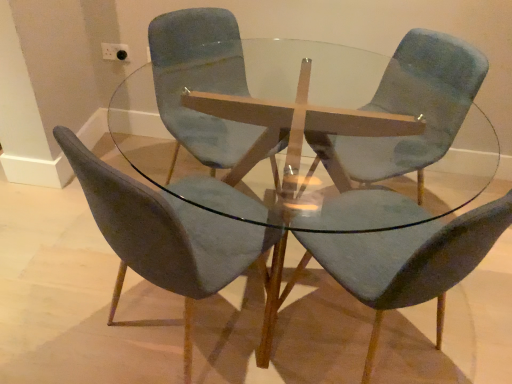
This screenshot has width=512, height=384. What do you see at coordinates (417, 105) in the screenshot?
I see `velvet blue chair at center, positioned as the first chair in right-to-left order` at bounding box center [417, 105].

Describe the element at coordinates (378, 137) in the screenshot. The height and width of the screenshot is (384, 512). I see `transparent glass table at center` at that location.

This screenshot has height=384, width=512. I want to click on velvet blue chair at center, which is the 2th chair in right-to-left order, so click(406, 262).

I want to click on velvet blue chair at center, which is the fourth chair in left-to-right order, so click(417, 105).

Do you think velvet blue chair at center, which is the fourth chair in left-to-right order, is within velvet blue chair at center, which is counted as the 4th chair, starting from the right, or outside of it?

velvet blue chair at center, which is the fourth chair in left-to-right order, lies outside velvet blue chair at center, which is counted as the 4th chair, starting from the right.

Is velvet blue chair at center, which is the fourth chair in left-to-right order, turned away from velvet blue chair at center, which is counted as the 4th chair, starting from the right?

velvet blue chair at center, which is the fourth chair in left-to-right order, is not turned away from velvet blue chair at center, which is counted as the 4th chair, starting from the right.

Is velvet blue chair at center, which is the fourth chair in left-to-right order, taller than velvet blue chair at center, which is counted as the 4th chair, starting from the right?

No.

Which is in front, point (413, 52) or point (111, 314)?

Point (111, 314)

In the scene shown: From their relative heights in the image, would you say velvet blue chair at center, which is the 2th chair in right-to-left order, is taller or shorter than velvet blue chair at center, which is the fourth chair in left-to-right order?

Clearly, velvet blue chair at center, which is the 2th chair in right-to-left order, is shorter compared to velvet blue chair at center, which is the fourth chair in left-to-right order.

Is velvet blue chair at center, which is the 2th chair in right-to-left order, aimed at velvet blue chair at center, which is the fourth chair in left-to-right order?

No.

From a real-world perspective, which object stands above the other?

velvet blue chair at center, which is counted as the 3th chair, starting from the left, from a real-world perspective.

From the image's perspective, is velvet blue chair at center, which is counted as the 3th chair, starting from the left, positioned above or below velvet blue chair at center, which is the fourth chair in left-to-right order?

velvet blue chair at center, which is counted as the 3th chair, starting from the left, is situated lower than velvet blue chair at center, which is the fourth chair in left-to-right order, in the image.

Which of these two, transparent glass table at center or velvet blue chair at center, placed as the 2th chair when sorted from left to right, stands shorter?

With less height is transparent glass table at center.

Considering their positions, is transparent glass table at center located in front of or behind velvet blue chair at center, placed as the 2th chair when sorted from left to right?

transparent glass table at center is in front of velvet blue chair at center, placed as the 2th chair when sorted from left to right.

Which chair is the 1st one when counting from the back of the transparent glass table at center? Please provide its 2D coordinates.

[(200, 82)]

Does transparent glass table at center have a smaller size compared to velvet blue chair at center, placed as the 2th chair when sorted from left to right?

No.

From the picture: How different are the orientations of velvet blue chair at center, which is the 2th chair in right-to-left order, and velvet blue chair at center, which appears as the 3th chair when viewed from the right, in degrees?

The facing directions of velvet blue chair at center, which is the 2th chair in right-to-left order, and velvet blue chair at center, which appears as the 3th chair when viewed from the right, are 179 degrees apart.

From the image's perspective, would you say velvet blue chair at center, which is the 2th chair in right-to-left order, is shown under velvet blue chair at center, placed as the 2th chair when sorted from left to right?

Indeed, from the image's perspective, velvet blue chair at center, which is the 2th chair in right-to-left order, is shown beneath velvet blue chair at center, placed as the 2th chair when sorted from left to right.

Does velvet blue chair at center, which is the 2th chair in right-to-left order, have a lesser height compared to velvet blue chair at center, which appears as the 3th chair when viewed from the right?

Yes.

Consider the image. Would you say velvet blue chair at center, placed as the 2th chair when sorted from left to right, contains velvet blue chair at center, which is the fourth chair in left-to-right order?

No, velvet blue chair at center, which is the fourth chair in left-to-right order, is not surrounded by velvet blue chair at center, placed as the 2th chair when sorted from left to right.

Is velvet blue chair at center, which appears as the 3th chair when viewed from the right, smaller than velvet blue chair at center, positioned as the first chair in right-to-left order?

No.

Which is in front, point (199, 134) or point (443, 47)?

Point (443, 47)

From a real-world perspective, is velvet blue chair at center, positioned as the first chair in right-to-left order, above or below transparent glass table at center?

From a real-world perspective, velvet blue chair at center, positioned as the first chair in right-to-left order, is physically above transparent glass table at center.

Locate an element on the screen. The width and height of the screenshot is (512, 384). chair that is the 1st one above the transparent glass table at center (from a real-world perspective) is located at coordinates (417, 105).

Looking at this image, considering the sizes of velvet blue chair at center, positioned as the first chair in right-to-left order, and transparent glass table at center in the image, is velvet blue chair at center, positioned as the first chair in right-to-left order, wider or thinner than transparent glass table at center?

velvet blue chair at center, positioned as the first chair in right-to-left order, is thinner than transparent glass table at center.

Is velvet blue chair at center, placed as the 2th chair when sorted from left to right, turned away from velvet blue chair at center, which is the 2th chair in right-to-left order?

That's not correct — velvet blue chair at center, placed as the 2th chair when sorted from left to right, is not looking away from velvet blue chair at center, which is the 2th chair in right-to-left order.

Consider the image. Can you confirm if velvet blue chair at center, placed as the 2th chair when sorted from left to right, is taller than velvet blue chair at center, which is the 2th chair in right-to-left order?

Indeed, velvet blue chair at center, placed as the 2th chair when sorted from left to right, has a greater height compared to velvet blue chair at center, which is the 2th chair in right-to-left order.

Considering the positions of objects velvet blue chair at center, placed as the 2th chair when sorted from left to right, and velvet blue chair at center, which is the 2th chair in right-to-left order, in the image provided, who is more to the right, velvet blue chair at center, placed as the 2th chair when sorted from left to right, or velvet blue chair at center, which is the 2th chair in right-to-left order,?

From the viewer's perspective, velvet blue chair at center, which is the 2th chair in right-to-left order, appears more on the right side.

Which is in front, velvet blue chair at center, placed as the 2th chair when sorted from left to right, or velvet blue chair at center, which is the 2th chair in right-to-left order?

velvet blue chair at center, which is the 2th chair in right-to-left order, is closer to the camera.

Find the location of `chair that is the 3rd one when counting backward from the velvet blue chair at center, which is counted as the 4th chair, starting from the right`. chair that is the 3rd one when counting backward from the velvet blue chair at center, which is counted as the 4th chair, starting from the right is located at coordinates (417, 105).

I want to click on the 1st chair directly above the velvet blue chair at center, positioned as the first chair in right-to-left order (from a real-world perspective), so click(406, 262).

Considering their positions, is transparent glass table at center positioned further to velvet blue chair at center, which appears as the 3th chair when viewed from the right, than velvet blue chair at center, the first chair positioned from the left?

transparent glass table at center lies further to velvet blue chair at center, which appears as the 3th chair when viewed from the right, than the other object.

From the image, which object appears to be nearer to transparent glass table at center, velvet blue chair at center, the first chair positioned from the left, or velvet blue chair at center, placed as the 2th chair when sorted from left to right?

velvet blue chair at center, the first chair positioned from the left.

Which object lies nearer to the anchor point velvet blue chair at center, the first chair positioned from the left, velvet blue chair at center, which is counted as the 3th chair, starting from the left, or transparent glass table at center?

The object closer to velvet blue chair at center, the first chair positioned from the left, is transparent glass table at center.

Looking at the image, which one is located closer to velvet blue chair at center, placed as the 2th chair when sorted from left to right, velvet blue chair at center, positioned as the first chair in right-to-left order, or transparent glass table at center?

velvet blue chair at center, positioned as the first chair in right-to-left order, lies closer to velvet blue chair at center, placed as the 2th chair when sorted from left to right, than the other object.

Considering their positions, is velvet blue chair at center, which is the fourth chair in left-to-right order, positioned closer to velvet blue chair at center, which is counted as the 4th chair, starting from the right, than velvet blue chair at center, which appears as the 3th chair when viewed from the right?

The object closer to velvet blue chair at center, which is counted as the 4th chair, starting from the right, is velvet blue chair at center, which appears as the 3th chair when viewed from the right.

Based on their spatial positions, is velvet blue chair at center, which is counted as the 3th chair, starting from the left, or velvet blue chair at center, which is counted as the 4th chair, starting from the right, closer to transparent glass table at center?

velvet blue chair at center, which is counted as the 3th chair, starting from the left, is positioned closer to the anchor transparent glass table at center.

Which object lies further to the anchor point velvet blue chair at center, which is the fourth chair in left-to-right order, velvet blue chair at center, which appears as the 3th chair when viewed from the right, or transparent glass table at center?

velvet blue chair at center, which appears as the 3th chair when viewed from the right, is positioned further to the anchor velvet blue chair at center, which is the fourth chair in left-to-right order.

Considering their positions, is velvet blue chair at center, which is counted as the 3th chair, starting from the left, positioned closer to velvet blue chair at center, the first chair positioned from the left, than velvet blue chair at center, placed as the 2th chair when sorted from left to right?

The object closer to velvet blue chair at center, the first chair positioned from the left, is velvet blue chair at center, which is counted as the 3th chair, starting from the left.

Identify the location of coffee table between velvet blue chair at center, placed as the 2th chair when sorted from left to right, and velvet blue chair at center, which is counted as the 3th chair, starting from the left, in the horizontal direction. (378, 137).

The width and height of the screenshot is (512, 384). Identify the location of coffee table between velvet blue chair at center, placed as the 2th chair when sorted from left to right, and velvet blue chair at center, positioned as the first chair in right-to-left order. (378, 137).

At what (x,y) coordinates should I click in order to perform the action: click on chair situated between velvet blue chair at center, placed as the 2th chair when sorted from left to right, and velvet blue chair at center, positioned as the first chair in right-to-left order, from left to right. Please return your answer as a coordinate pair (x, y). The image size is (512, 384). Looking at the image, I should click on (406, 262).

You are a GUI agent. You are given a task and a screenshot of the screen. Output one action in this format:
    pyautogui.click(x=<x>, y=<y>)
    Task: Click on the coffee table located between velvet blue chair at center, the first chair positioned from the left, and velvet blue chair at center, which is the 2th chair in right-to-left order, in the left-right direction
    The height and width of the screenshot is (384, 512).
    Given the screenshot: What is the action you would take?
    pyautogui.click(x=378, y=137)